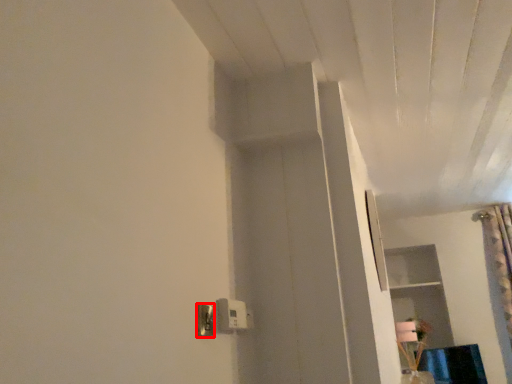
Question: From the image's perspective, what is the correct spatial positioning of light switch (annotated by the red box) in reference to light switch?

Choices:
 (A) below
 (B) above

Answer: (B)